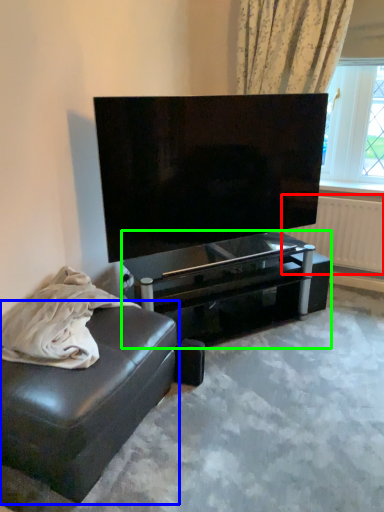
Question: Which object is the closest to the radiator (highlighted by a red box)? Choose among these: studio couch (highlighted by a blue box) or table (highlighted by a green box).

Choices:
 (A) studio couch
 (B) table

Answer: (B)